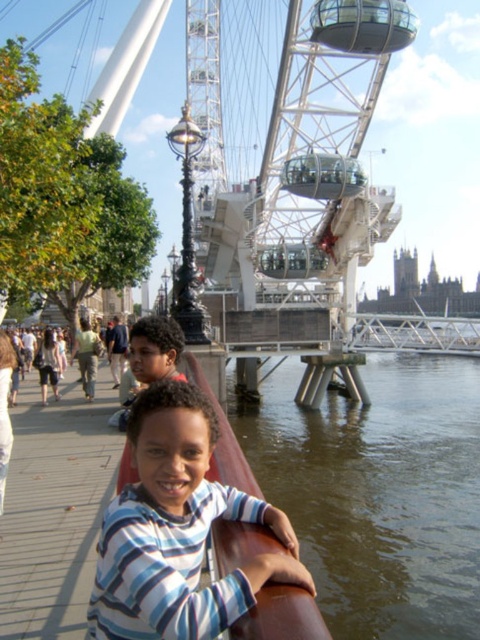
Does brown water at lower right have a lesser width compared to striped cotton shirt at center?

No.

Which is above, brown water at lower right or striped cotton shirt at center?

brown water at lower right is higher up.

Does point (463, 516) lie behind point (141, 440)?

Yes, point (463, 516) is farther from viewer.

Where is `brown water at lower right`? This screenshot has width=480, height=640. brown water at lower right is located at coordinates (381, 493).

Who is taller, brown water at lower right or white metallic ferris wheel at center?

With more height is white metallic ferris wheel at center.

Can you confirm if brown water at lower right is wider than white metallic ferris wheel at center?

Yes, brown water at lower right is wider than white metallic ferris wheel at center.

Is point (441, 413) farther from viewer compared to point (357, 195)?

Yes, it is behind point (357, 195).

I want to click on brown water at lower right, so click(381, 493).

Does white metallic ferris wheel at center come in front of matte brown hair at center?

Yes, white metallic ferris wheel at center is in front of matte brown hair at center.

Consider the image. Which is above, white metallic ferris wheel at center or matte brown hair at center?

white metallic ferris wheel at center

Image resolution: width=480 pixels, height=640 pixels. Identify the location of white metallic ferris wheel at center. (292, 141).

The width and height of the screenshot is (480, 640). I want to click on white metallic ferris wheel at center, so click(292, 141).